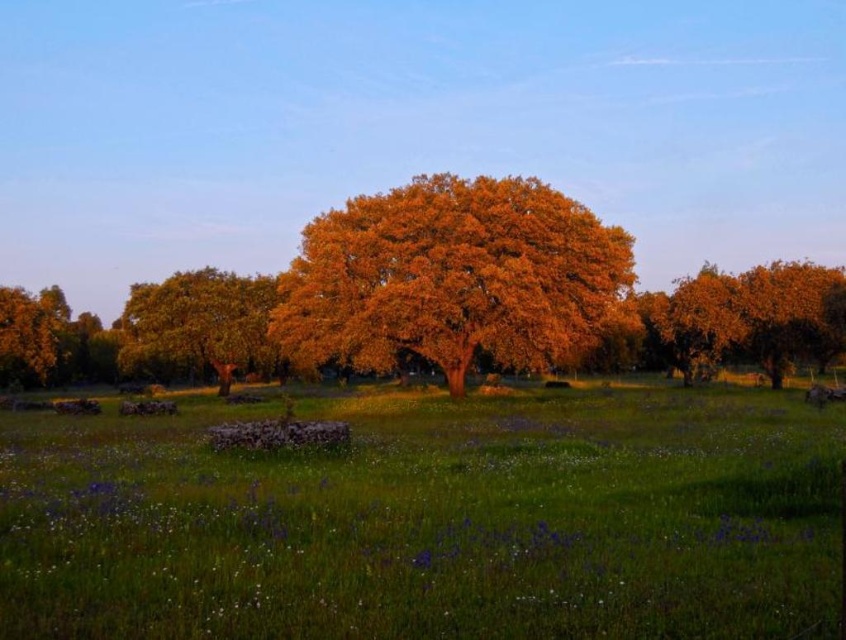
Question: Which point is farther to the camera?

Choices:
 (A) golden textured tree at center
 (B) golden textured tree at left

Answer: (B)

Question: Which point is closer to the camera taking this photo?

Choices:
 (A) (410, 300)
 (B) (253, 285)
 (C) (512, 433)

Answer: (C)

Question: Where is green grassy field at center located in relation to golden textured tree at center in the image?

Choices:
 (A) right
 (B) left

Answer: (A)

Question: Does green grassy field at center lie in front of golden textured tree at center?

Choices:
 (A) no
 (B) yes

Answer: (B)

Question: Does golden textured tree at center appear over golden textured tree at left?

Choices:
 (A) yes
 (B) no

Answer: (A)

Question: Among these objects, which one is nearest to the camera?

Choices:
 (A) golden textured tree at left
 (B) golden textured tree at center

Answer: (B)